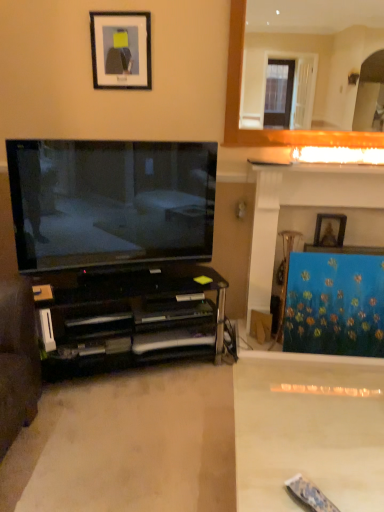
Question: Is the position of black matte picture frame at upper center, which is the second picture frame from back to front, more distant than that of blue textured curtain at right?

Choices:
 (A) no
 (B) yes

Answer: (A)

Question: Does black matte picture frame at upper center, which appears as the second picture frame when ordered from the bottom, have a greater height compared to blue textured curtain at right?

Choices:
 (A) no
 (B) yes

Answer: (A)

Question: From a real-world perspective, is black matte picture frame at upper center, the 1th picture frame from the left, over blue textured curtain at right?

Choices:
 (A) no
 (B) yes

Answer: (B)

Question: Can you confirm if black matte picture frame at upper center, which is the second picture frame from back to front, is wider than blue textured curtain at right?

Choices:
 (A) yes
 (B) no

Answer: (B)

Question: Considering the relative sizes of black matte picture frame at upper center, arranged as the first picture frame when viewed from the front, and blue textured curtain at right in the image provided, is black matte picture frame at upper center, arranged as the first picture frame when viewed from the front, shorter than blue textured curtain at right?

Choices:
 (A) yes
 (B) no

Answer: (A)

Question: Based on their positions, is matte black tv at left located to the left or right of wooden picture frame at upper right, acting as the 1th picture frame starting from the back?

Choices:
 (A) left
 (B) right

Answer: (A)

Question: Is matte black tv at left taller or shorter than wooden picture frame at upper right, acting as the 1th picture frame starting from the back?

Choices:
 (A) short
 (B) tall

Answer: (B)

Question: From a real-world perspective, is matte black tv at left positioned above or below wooden picture frame at upper right, acting as the 1th picture frame starting from the back?

Choices:
 (A) above
 (B) below

Answer: (A)

Question: Is matte black tv at left bigger or smaller than wooden picture frame at upper right, which is the 2th picture frame in front-to-back order?

Choices:
 (A) small
 (B) big

Answer: (B)

Question: In terms of width, does matte black tv at left look wider or thinner when compared to black glass cabinet at left?

Choices:
 (A) thin
 (B) wide

Answer: (A)

Question: Is matte black tv at left taller or shorter than black glass cabinet at left?

Choices:
 (A) tall
 (B) short

Answer: (A)

Question: Do you think matte black tv at left is within black glass cabinet at left, or outside of it?

Choices:
 (A) outside
 (B) inside

Answer: (A)

Question: In the image, is matte black tv at left on the left side or the right side of black glass cabinet at left?

Choices:
 (A) right
 (B) left

Answer: (A)

Question: Considering the positions of point pyautogui.click(x=233, y=94) and point pyautogui.click(x=369, y=263), is point pyautogui.click(x=233, y=94) closer or farther from the camera than point pyautogui.click(x=369, y=263)?

Choices:
 (A) farther
 (B) closer

Answer: (A)

Question: From a real-world perspective, is white marble fireplace at upper right positioned above or below blue textured curtain at right?

Choices:
 (A) above
 (B) below

Answer: (A)